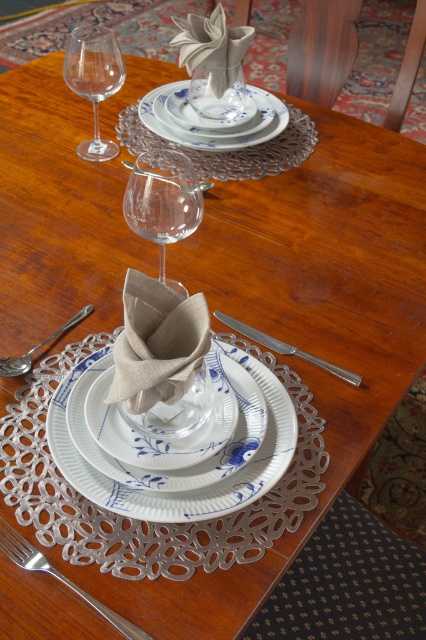
Who is more forward, [284,392] or [184,99]?

Point [284,392] is in front.

Does white porcelain plate at center appear under blue porcelain saucer at center?

Yes, white porcelain plate at center is below blue porcelain saucer at center.

Between point (229, 444) and point (238, 124), which one is positioned in front?

Point (229, 444) is in front.

Locate an element on the screen. The height and width of the screenshot is (640, 426). white porcelain plate at center is located at coordinates (172, 470).

Does transparent glass wine glass at center have a lesser width compared to silver metallic knife at center?

Indeed, transparent glass wine glass at center has a lesser width compared to silver metallic knife at center.

Does transparent glass wine glass at center have a lesser height compared to silver metallic knife at center?

No, transparent glass wine glass at center is not shorter than silver metallic knife at center.

Where is `transparent glass wine glass at center`? transparent glass wine glass at center is located at coordinates (163, 202).

Is blue porcelain plate at center to the left of satin silver spoon at lower left from the viewer's perspective?

In fact, blue porcelain plate at center is to the right of satin silver spoon at lower left.

Does blue porcelain plate at center have a greater height compared to satin silver spoon at lower left?

Yes.

Who is more forward, (250, 97) or (31, 353)?

Positioned in front is point (31, 353).

I want to click on blue porcelain plate at center, so click(207, 128).